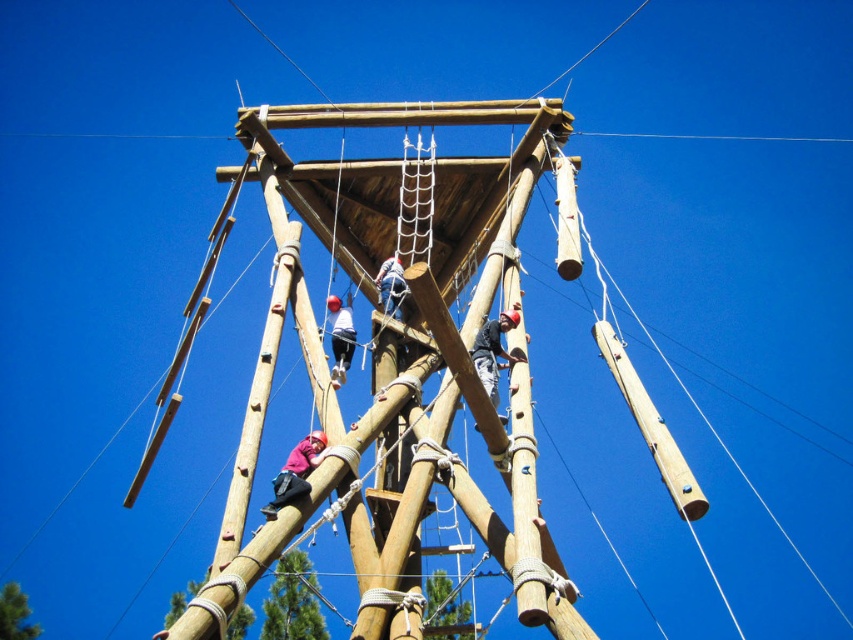
You are an instructor observing a climber wearing both the dark gray fabric climbing harness at center and the white fabric helmet at center. From the climber perspective, which item is located on the right side?

The dark gray fabric climbing harness at center is positioned on the right side of the white fabric helmet at center, so from the climber perspective, the dark gray fabric climbing harness at center is located on the right side.

You are an observer looking at the climbing structure. You see a dark gray fabric climbing harness at center and a pink fabric at center. Which fabric is covering the other?

The dark gray fabric climbing harness at center is positioned over the pink fabric at center, so it is covering it.

You are a safety inspector checking the climbing structure. You notice the white fabric helmet at center and the blue fabric climbing harness at center. According to safety regulations, the maximum allowed distance between a helmet and harness for proper safety is 10 feet. Is the current distance compliant with safety standards?

The distance between the white fabric helmet at center and the blue fabric climbing harness at center is 15.72 feet, which exceeds the 10 feet maximum allowed distance. Therefore, it does not comply with safety standards.